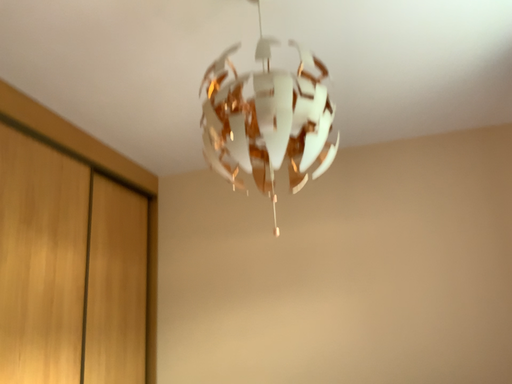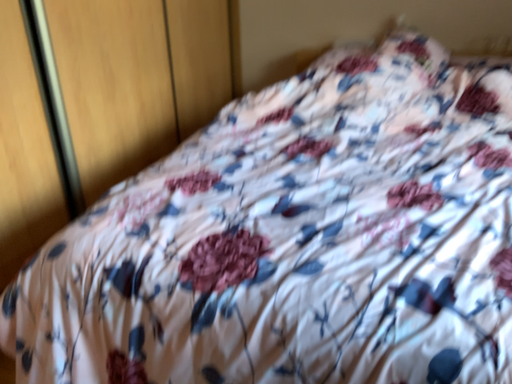
Question: Which way did the camera rotate in the video?

Choices:
 (A) rotated right
 (B) rotated left

Answer: (B)